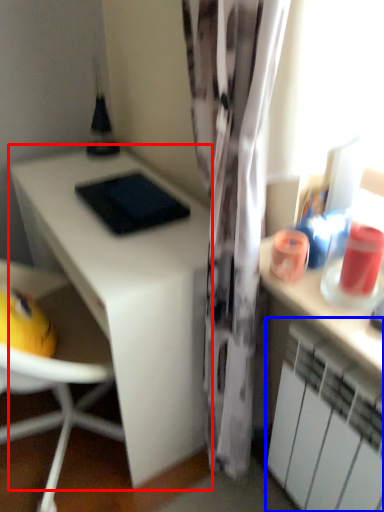
Question: Which of the following is the farthest to the observer, desk (highlighted by a red box) or cabinetry (highlighted by a blue box)?

Choices:
 (A) desk
 (B) cabinetry

Answer: (A)